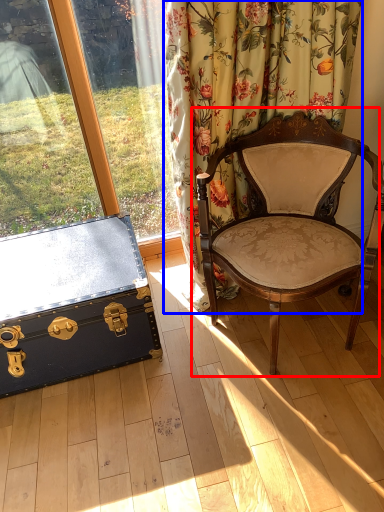
Question: Which point is further to the camera, chair (highlighted by a red box) or curtain (highlighted by a blue box)?

Choices:
 (A) chair
 (B) curtain

Answer: (B)